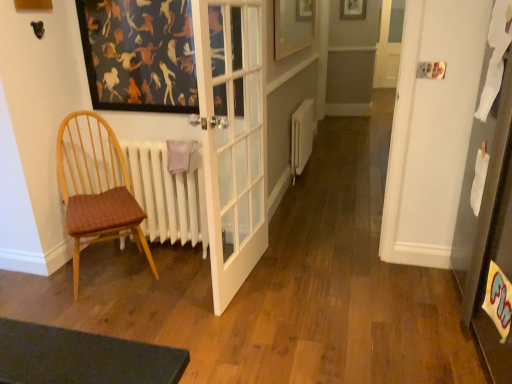
This screenshot has height=384, width=512. I want to click on vacant area that is in front of woven fabric chair at left, so click(116, 311).